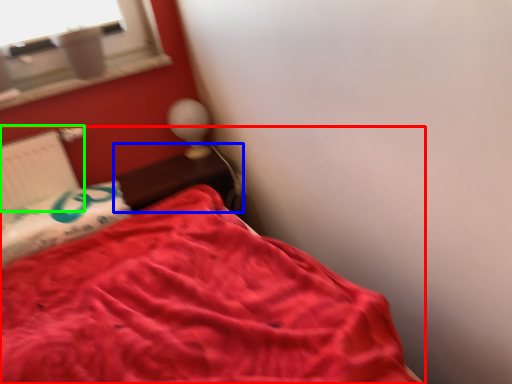
Question: Which object is the farthest from bed (highlighted by a red box)? Choose among these: table (highlighted by a blue box) or radiator (highlighted by a green box).

Choices:
 (A) table
 (B) radiator

Answer: (B)